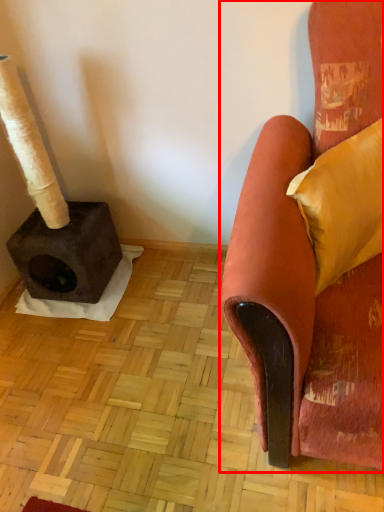
Question: From the image's perspective, considering the relative positions of chair (annotated by the red box) and pillow in the image provided, where is chair (annotated by the red box) located with respect to the staircase?

Choices:
 (A) below
 (B) above

Answer: (A)